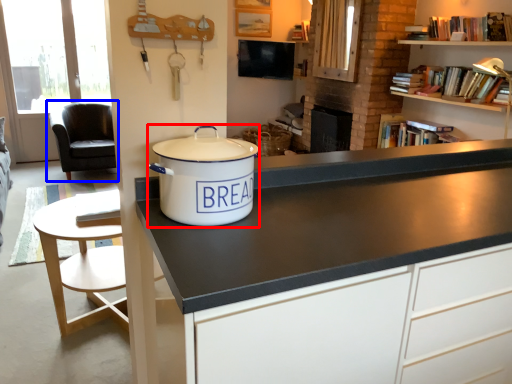
Question: Which of the following is the closest to the observer, cooker (highlighted by a red box) or chair (highlighted by a blue box)?

Choices:
 (A) cooker
 (B) chair

Answer: (A)